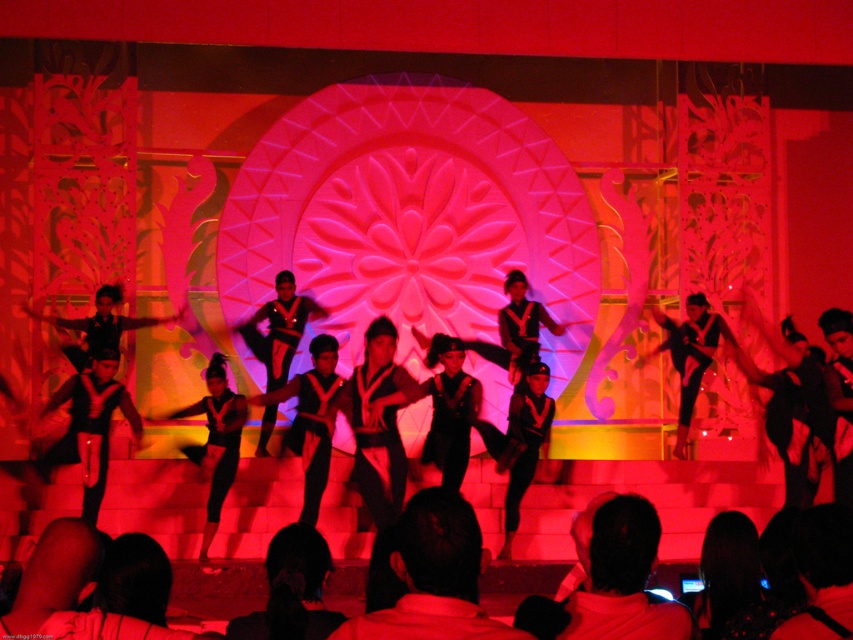
Does point (502, 634) come closer to viewer compared to point (595, 522)?

That is True.

Does black fabric pants at center appear under black fabric shirt at center?

Correct, black fabric pants at center is located below black fabric shirt at center.

Is point (427, 545) positioned behind point (654, 605)?

No.

The height and width of the screenshot is (640, 853). Identify the location of black fabric pants at center. pos(433,577).

Is black fabric shirt at center to the left of black matte leggings at center from the viewer's perspective?

In fact, black fabric shirt at center is to the right of black matte leggings at center.

Does point (585, 627) come closer to viewer compared to point (218, 451)?

Yes, point (585, 627) is closer to viewer.

At what (x,y) coordinates should I click in order to perform the action: click on black fabric shirt at center. Please return your answer as a coordinate pair (x, y). The height and width of the screenshot is (640, 853). Looking at the image, I should click on (619, 573).

Is point (409, 544) closer to viewer compared to point (235, 458)?

That is True.

Can you confirm if black fabric pants at center is smaller than black matte leggings at center?

Yes.

Describe the element at coordinates (433, 577) in the screenshot. I see `black fabric pants at center` at that location.

This screenshot has width=853, height=640. I want to click on black fabric pants at center, so click(x=433, y=577).